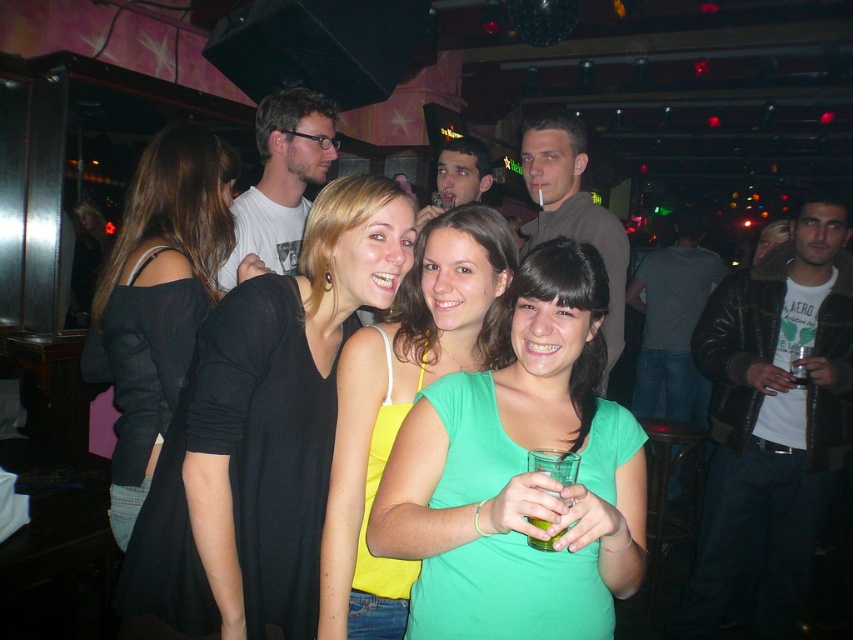
From the picture: You are a photographer setting up a shot for a fashion show. You have two models wearing the black matte dress at center and the yellow fabric tank top at center. Based on the scene description, which model should you position closer to the camera to ensure both outfits are clearly visible?

The black matte dress at center might be wider than the yellow fabric tank top at center, so positioning the model in the yellow fabric tank top at center closer to the camera would help maintain visibility for both outfits.

You are a photographer trying to capture a clear shot of both the black matte dress at center and the yellow fabric tank top at center. Since the camera can only focus on one object at a time, which one should you choose to ensure the larger object is in focus?

The black matte dress at center is bigger than the yellow fabric tank top at center, so you should focus on the black matte dress at center to ensure the larger object is in focus.